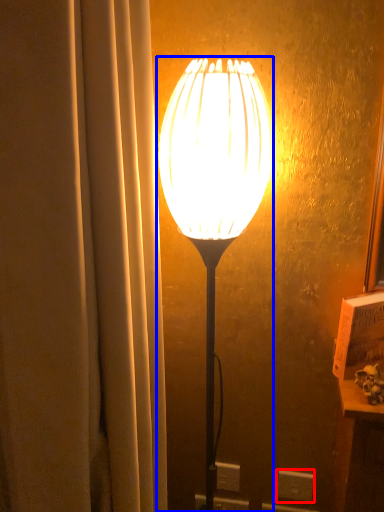
Question: Which of the following is the farthest to the observer, electric outlet (highlighted by a red box) or lamp (highlighted by a blue box)?

Choices:
 (A) electric outlet
 (B) lamp

Answer: (A)